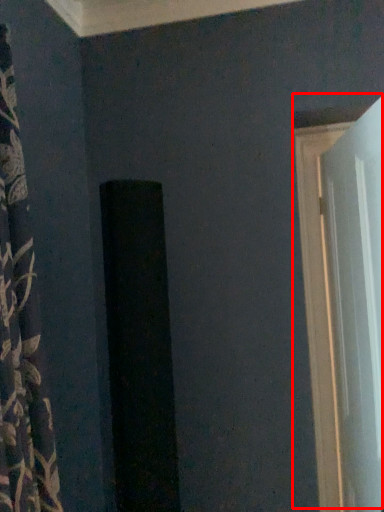
Question: From the image's perspective, where is door (annotated by the red box) located relative to curtain?

Choices:
 (A) below
 (B) above

Answer: (A)